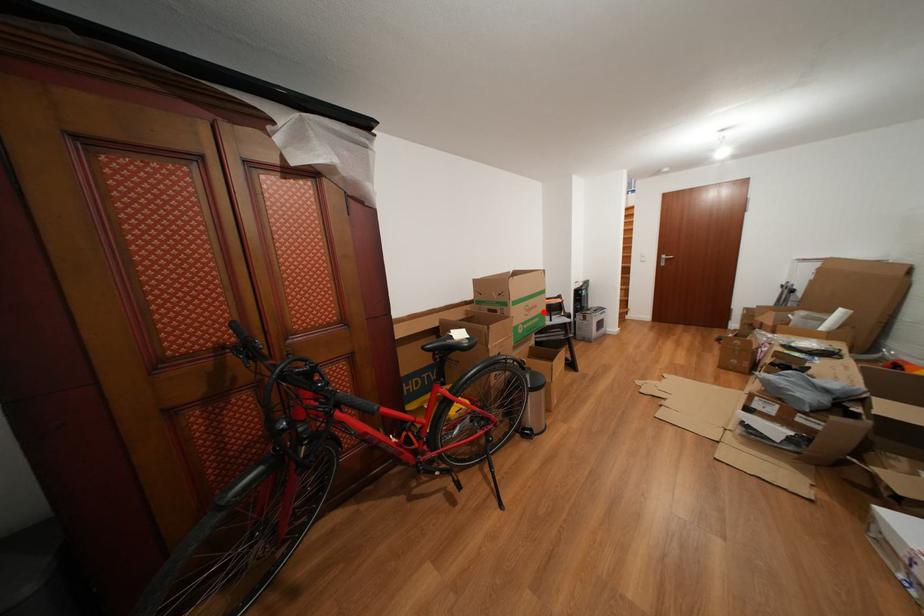
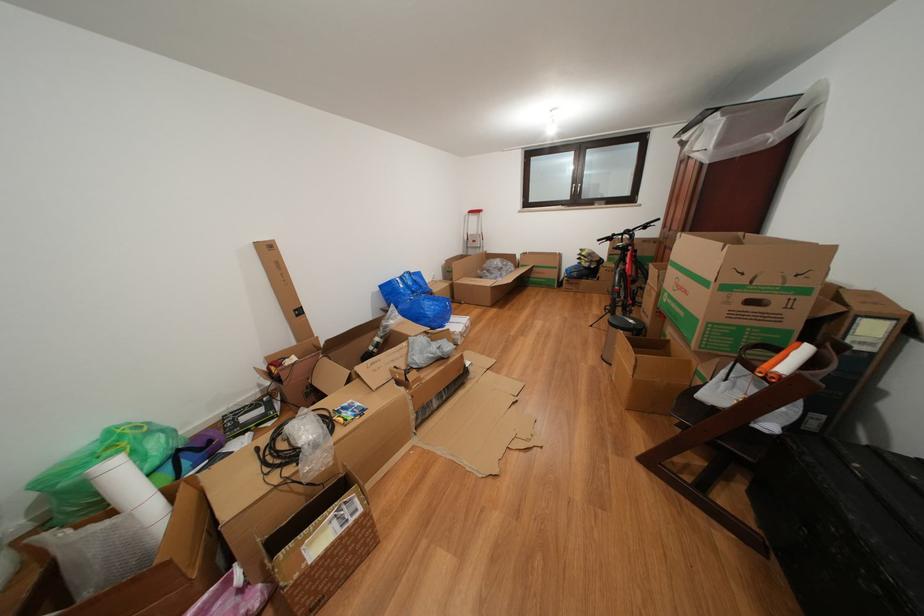
Question: I am providing you with two images of the same scene from different viewpoints. A red point is marked on the first image. At the location where the point appears in image 1, is it still visible in image 2?

Choices:
 (A) Yes
 (B) No

Answer: (A)